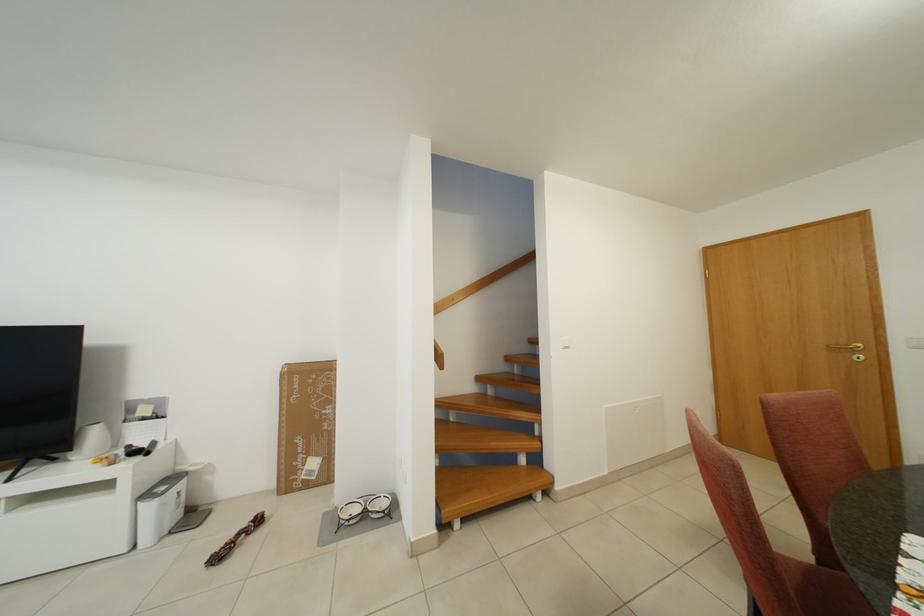
The height and width of the screenshot is (616, 924). In order to click on red chair sitting surface in this screenshot , I will do `click(822, 590)`.